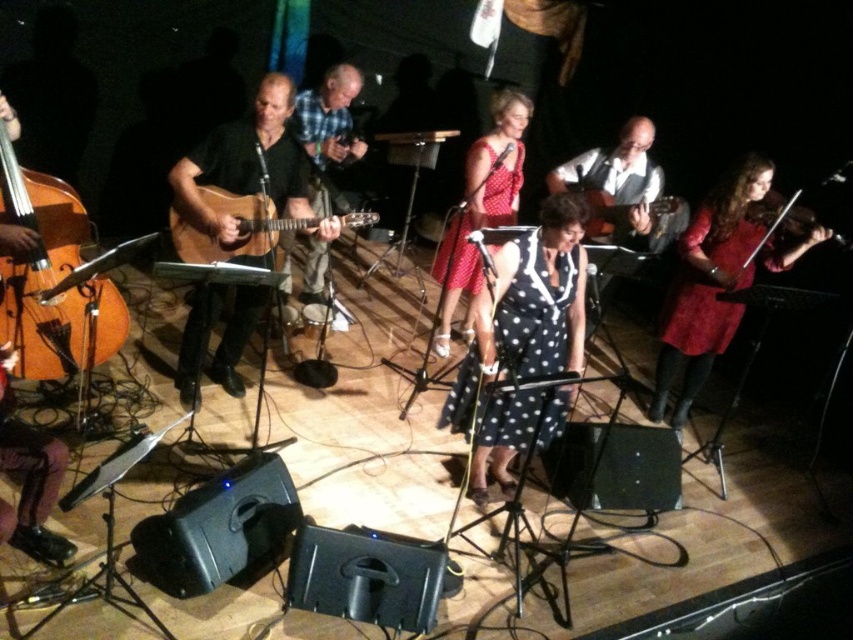
Is matte black guitar at center in front of acoustic guitar at center?

No, it is behind acoustic guitar at center.

Who is lower down, matte black guitar at center or acoustic guitar at center?

Positioned lower is acoustic guitar at center.

Between point (332, 227) and point (251, 234), which one is positioned behind?

Positioned behind is point (251, 234).

Where is `matte black guitar at center`? The height and width of the screenshot is (640, 853). matte black guitar at center is located at coordinates (245, 163).

What are the coordinates of `black polka dot dress at center` in the screenshot? It's located at (527, 308).

Is point (474, 364) positioned after point (683, 266)?

No, (474, 364) is closer to viewer.

Does point (566, 291) lie in front of point (726, 288)?

That is True.

Where is `black polka dot dress at center`? The height and width of the screenshot is (640, 853). black polka dot dress at center is located at coordinates (527, 308).

Which is more to the left, matte black guitar at center or red polka dot dress at center?

matte black guitar at center

Which is below, matte black guitar at center or red polka dot dress at center?

red polka dot dress at center

Measure the distance between matte black guitar at center and camera.

They are 3.51 meters apart.

Locate an element on the screen. matte black guitar at center is located at coordinates (245, 163).